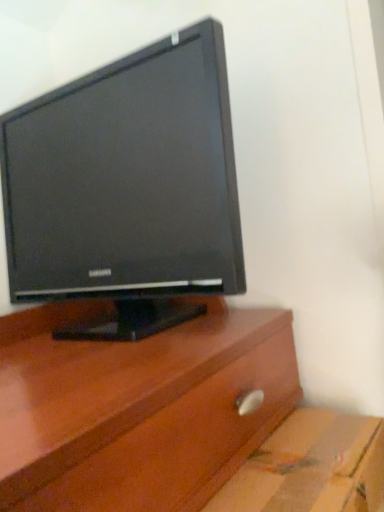
Question: In terms of height, does cardboard at lower right look taller or shorter compared to black glossy monitor at upper center?

Choices:
 (A) short
 (B) tall

Answer: (A)

Question: Would you say cardboard at lower right is to the left or to the right of black glossy monitor at upper center in the picture?

Choices:
 (A) left
 (B) right

Answer: (B)

Question: Considering the positions of cardboard at lower right and black glossy monitor at upper center in the image, is cardboard at lower right wider or thinner than black glossy monitor at upper center?

Choices:
 (A) wide
 (B) thin

Answer: (B)

Question: Is point (218, 76) positioned closer to the camera than point (362, 434)?

Choices:
 (A) farther
 (B) closer

Answer: (A)

Question: From the image's perspective, is black glossy monitor at upper center located above or below cardboard at lower right?

Choices:
 (A) below
 (B) above

Answer: (B)

Question: Visually, is black glossy monitor at upper center positioned to the left or to the right of cardboard at lower right?

Choices:
 (A) left
 (B) right

Answer: (A)

Question: Is black glossy monitor at upper center bigger or smaller than cardboard at lower right?

Choices:
 (A) small
 (B) big

Answer: (B)